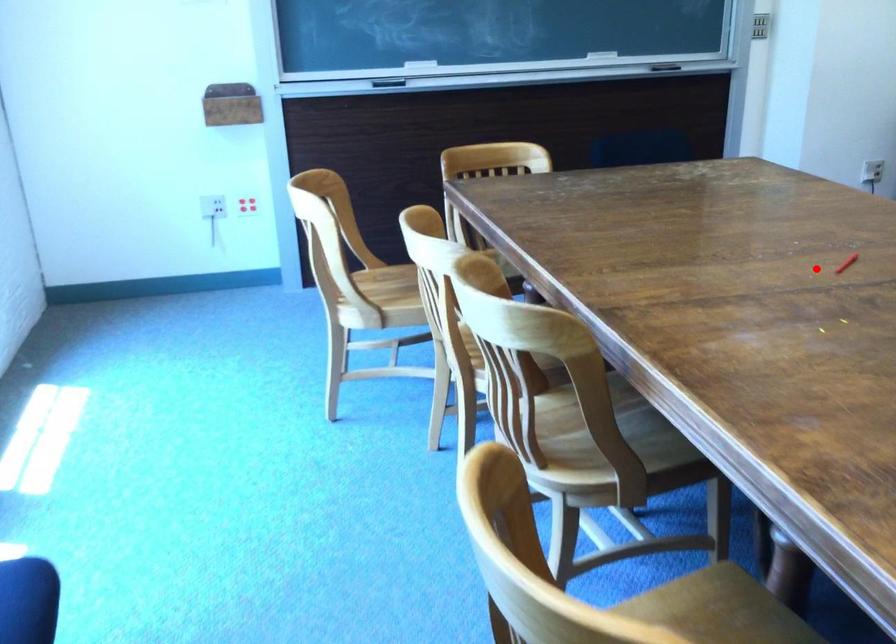
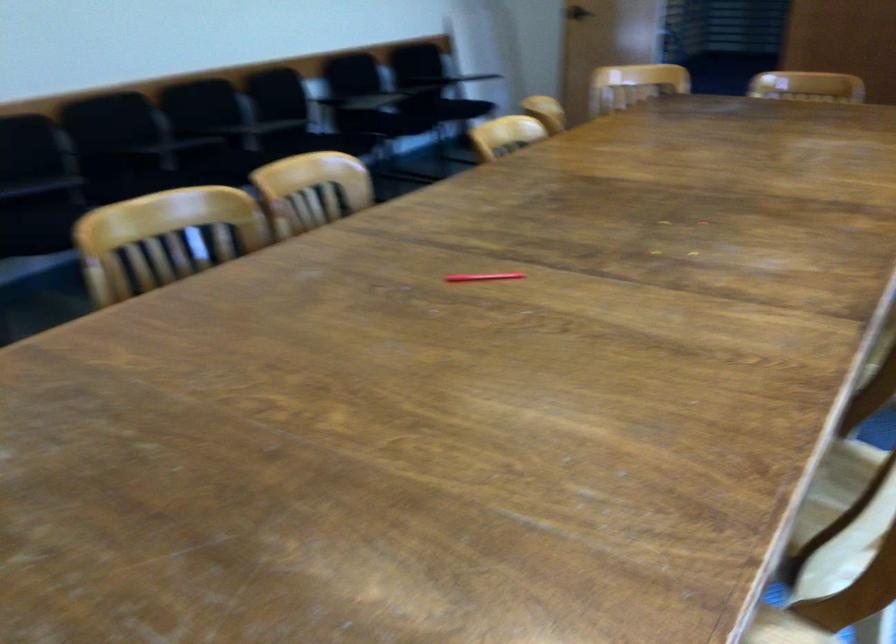
The point at the highlighted location is marked in the first image. Where is the corresponding point in the second image?

(486, 279)